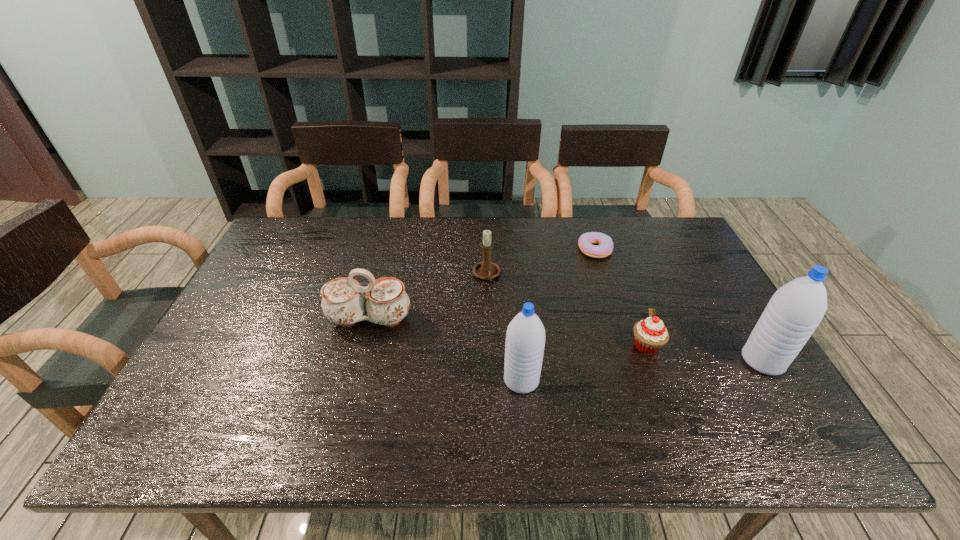
This screenshot has width=960, height=540. What are the coordinates of `vacant space located on the left of the tallest object` in the screenshot? It's located at (587, 361).

What are the coordinates of `vacant space located on the left of the doughnut` in the screenshot? It's located at (511, 249).

Locate an element on the screen. Image resolution: width=960 pixels, height=540 pixels. free spot located on the side of the second farthest object with the handle is located at coordinates (488, 306).

Where is `free space located by the handle of the chinaware`? This screenshot has width=960, height=540. free space located by the handle of the chinaware is located at coordinates (356, 372).

The width and height of the screenshot is (960, 540). What are the coordinates of `vacant space situated on the back of the fifth tallest object` in the screenshot? It's located at (611, 247).

Find the location of a particular element. The height and width of the screenshot is (540, 960). object that is positioned at the far edge is located at coordinates (586, 240).

The height and width of the screenshot is (540, 960). In order to click on object that is at the near edge in this screenshot , I will do `click(525, 339)`.

Locate an element on the screen. The height and width of the screenshot is (540, 960). object present at the right edge is located at coordinates (796, 309).

Where is `vacant region at the far edge`? vacant region at the far edge is located at coordinates (427, 242).

Find the location of `free region at the near edge`. free region at the near edge is located at coordinates (498, 402).